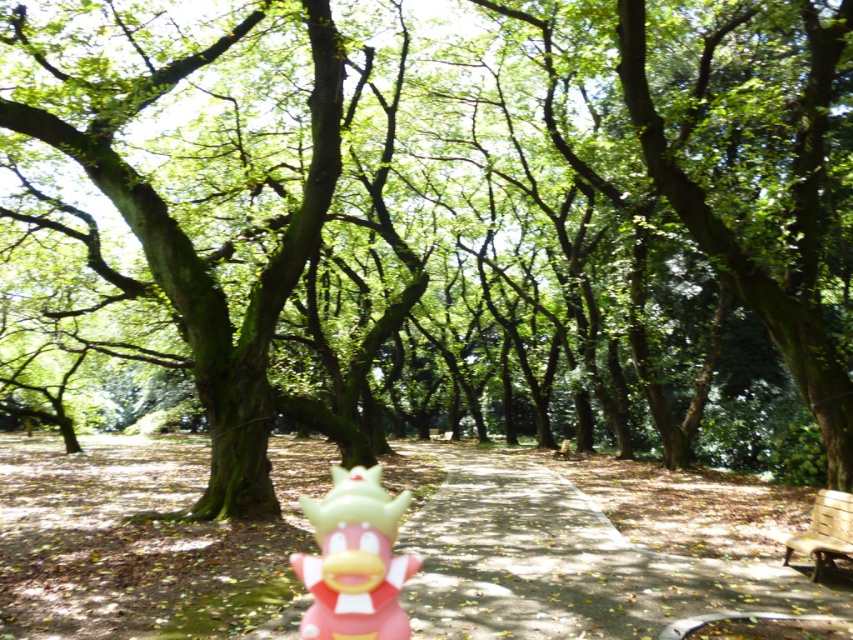
Question: Is pink rubber toy at center wider than wooden park bench at lower right?

Choices:
 (A) no
 (B) yes

Answer: (A)

Question: Does pink rubber toy at center have a lesser width compared to wooden park bench at lower right?

Choices:
 (A) no
 (B) yes

Answer: (B)

Question: Can you confirm if pink rubber toy at center is thinner than wooden park bench at lower right?

Choices:
 (A) yes
 (B) no

Answer: (A)

Question: Which point appears closest to the camera in this image?

Choices:
 (A) [845, 548]
 (B) [346, 566]

Answer: (B)